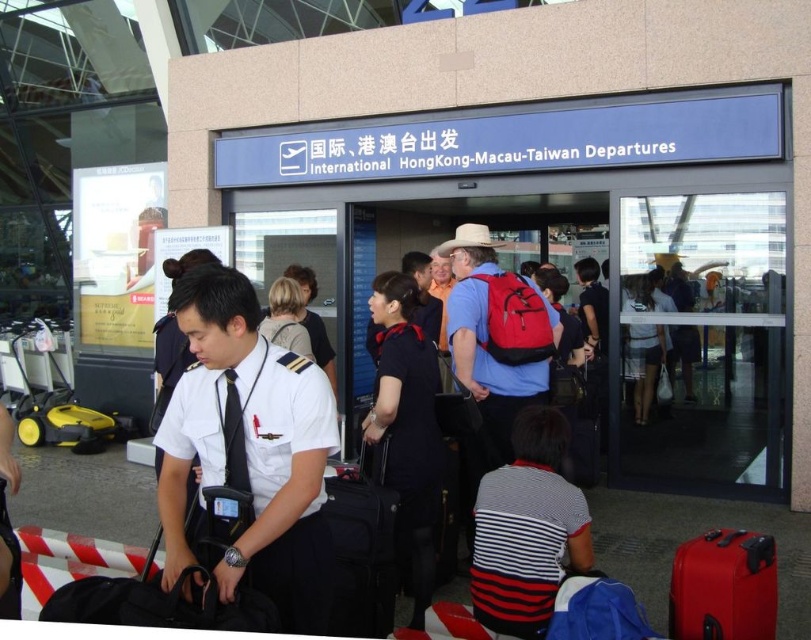
Question: Which object appears farthest from the camera in this image?

Choices:
 (A) light brown leather jacket at center
 (B) black fabric dress at center

Answer: (A)

Question: Which point is farther to the camera?

Choices:
 (A) (531, 396)
 (B) (629, 376)

Answer: (B)

Question: Does white cotton shirt at center come in front of striped fabric shirt at center?

Choices:
 (A) no
 (B) yes

Answer: (B)

Question: Which of these objects is positioned closest to the blonde hair at center?

Choices:
 (A) black fabric dress at center
 (B) striped fabric shirt at center
 (C) light brown leather jacket at center

Answer: (C)

Question: Does matte red suitcase at lower right appear on the left side of white cotton dress at center?

Choices:
 (A) no
 (B) yes

Answer: (B)

Question: Can you confirm if black fabric suitcase at lower center is smaller than blonde hair at center?

Choices:
 (A) no
 (B) yes

Answer: (A)